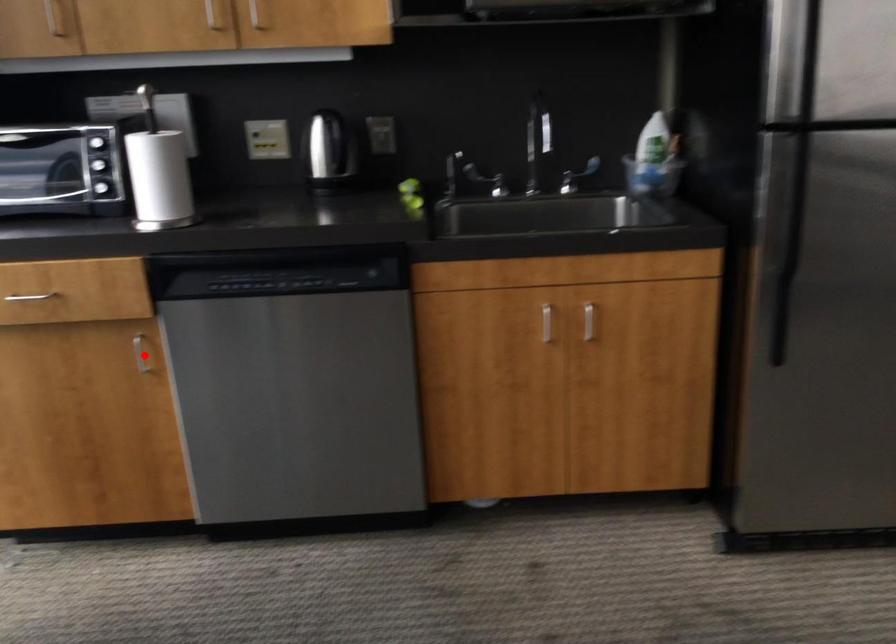
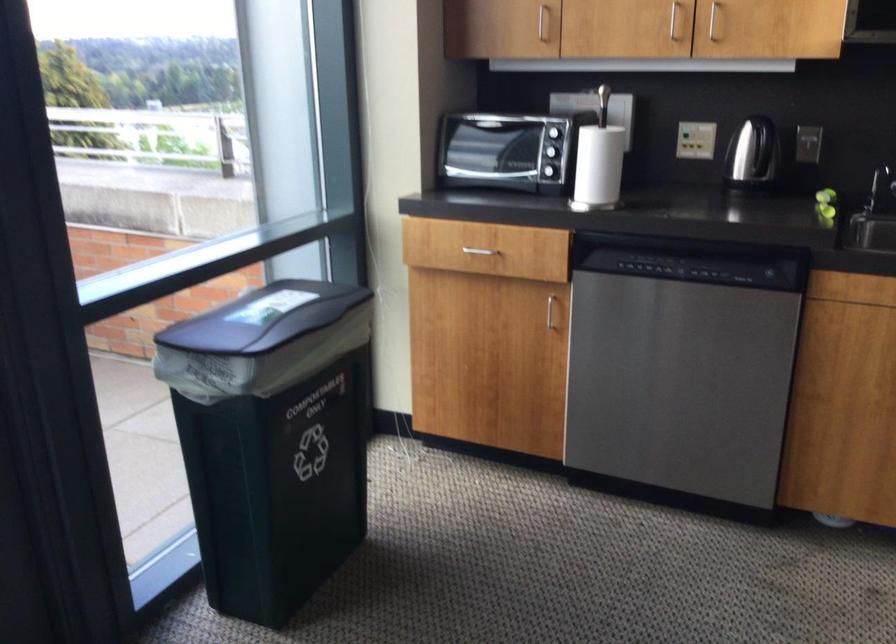
Question: I am providing you with two images of the same scene from different viewpoints. A red point is shown in image1. For the corresponding object point in image2, is it positioned nearer or farther from the camera?

Choices:
 (A) Nearer
 (B) Farther

Answer: (B)